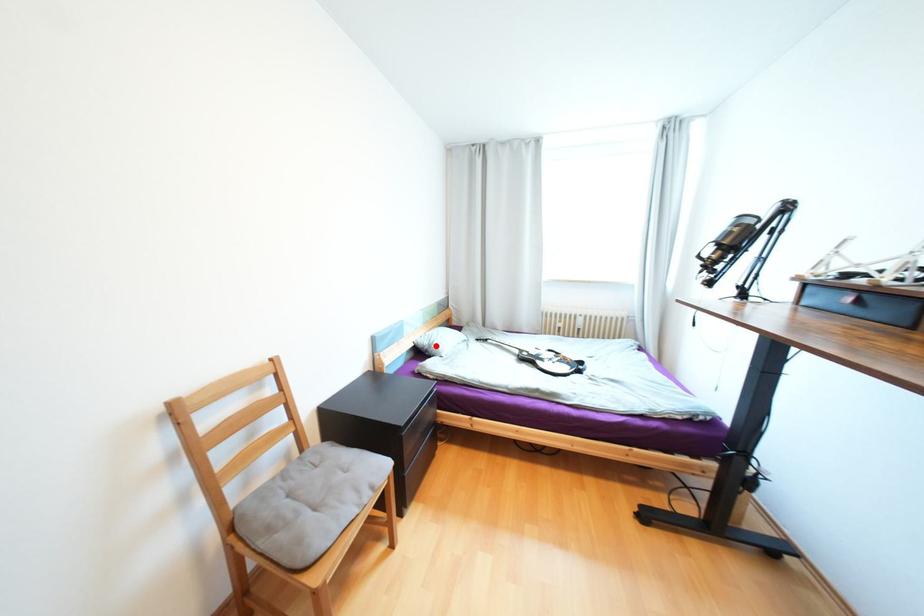
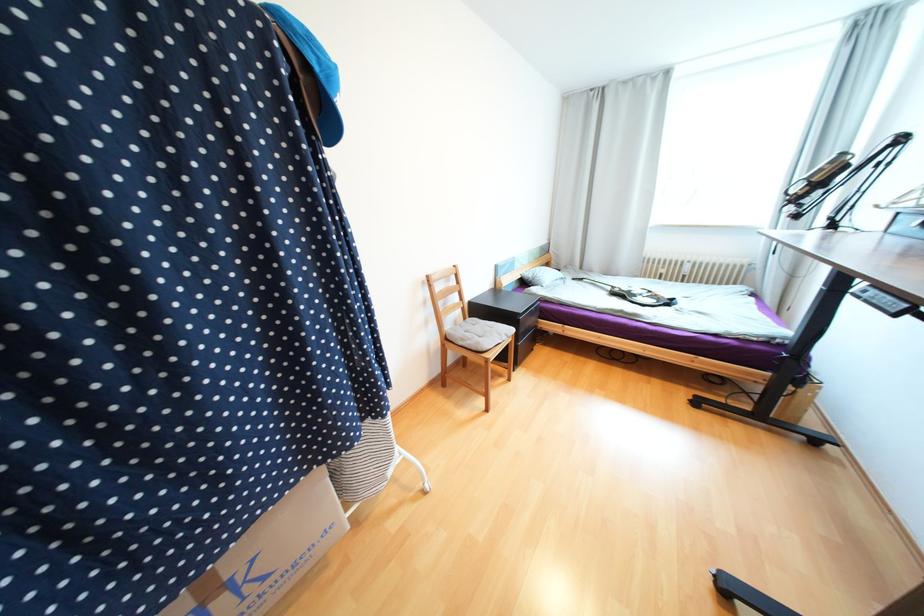
In the second image, find the point that corresponds to the highlighted location in the first image.

(540, 278)